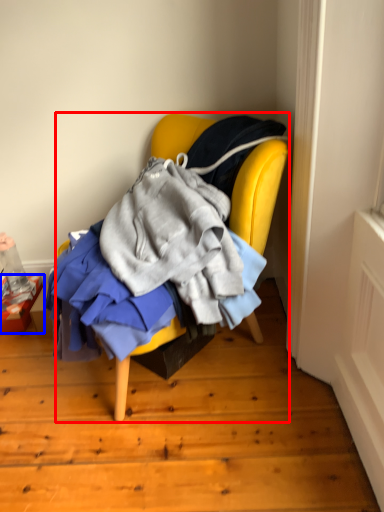
Question: Which of the following is the farthest to the observer, chair (highlighted by a red box) or box (highlighted by a blue box)?

Choices:
 (A) chair
 (B) box

Answer: (B)